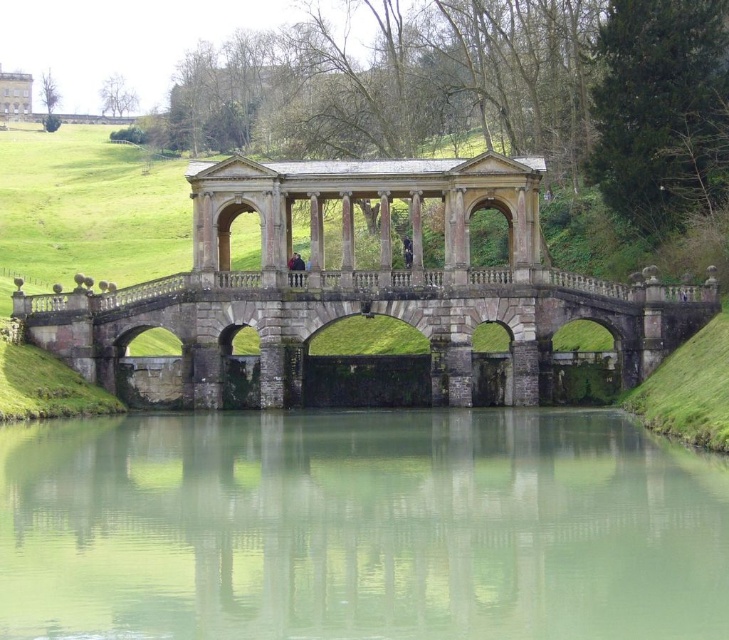
You are standing on the stone arch bridge at center and want to take a photo of the white stone palace at upper left. Which direction should you face to capture both the bridge and the palace in the frame?

Since the stone arch bridge at center is closer to the viewer than the white stone palace at upper left, you should face towards the upper left direction to include both the bridge and the palace in the photo.

You are an architect analyzing the image of a classical stone bridge and the water beneath it. Based on the scene, which object has a narrower width between the green smooth water at center and the stone arch bridge at center?

The green smooth water at center is thinner than the stone arch bridge at center, meaning the water has a narrower width compared to the bridge.